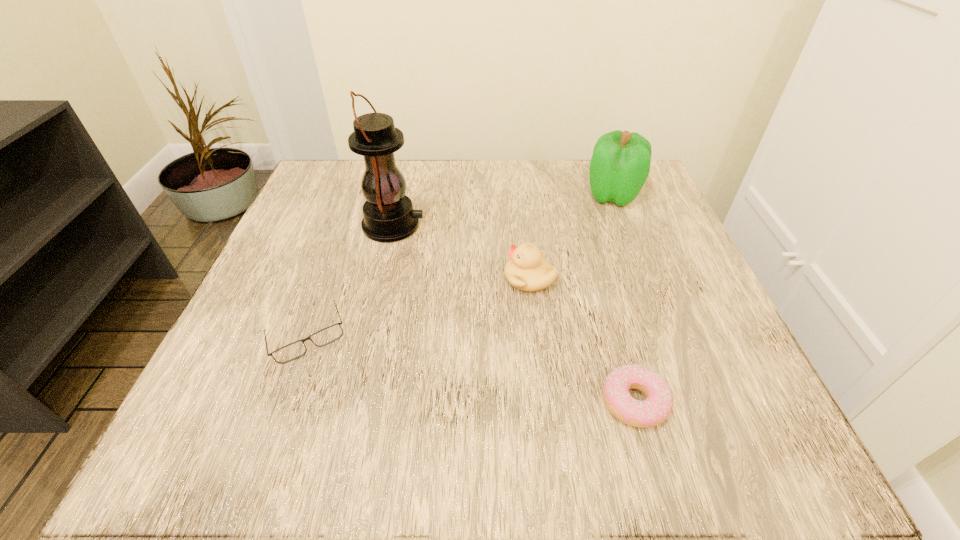
Locate an element on the screen. The width and height of the screenshot is (960, 540). vacant area located 0.320m on the beak of the duckling is located at coordinates (327, 279).

Identify the location of free point located 0.110m with the lenses facing outward on the spectacles. This screenshot has height=540, width=960. (273, 435).

The width and height of the screenshot is (960, 540). I want to click on free space located 0.280m on the left of the doughnut, so click(x=401, y=402).

The width and height of the screenshot is (960, 540). I want to click on lantern at the far edge, so click(388, 216).

This screenshot has width=960, height=540. What are the coordinates of `bell pepper located at the far edge` in the screenshot? It's located at (620, 164).

In order to click on object present at the near edge in this screenshot , I will do `click(657, 406)`.

Find the location of a particular element. The height and width of the screenshot is (540, 960). lantern located at the left edge is located at coordinates (388, 216).

Locate an element on the screen. The width and height of the screenshot is (960, 540). spectacles at the left edge is located at coordinates (292, 351).

Where is `bell pepper present at the right edge`? bell pepper present at the right edge is located at coordinates (620, 164).

Identify the location of doughnut positioned at the right edge. The height and width of the screenshot is (540, 960). pyautogui.click(x=657, y=406).